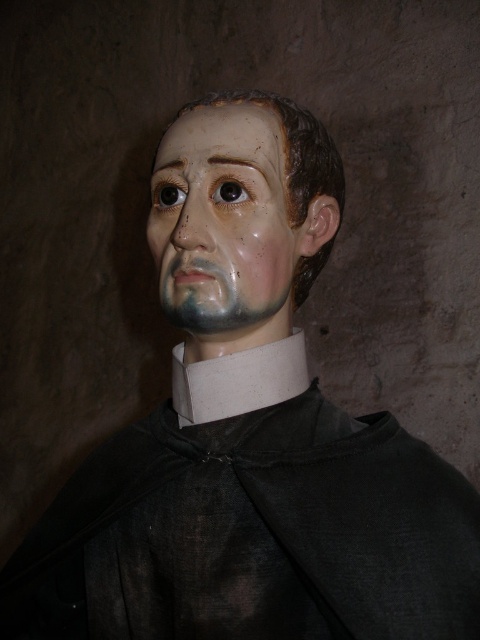
Question: Is black matte robe at center positioned behind matte plastic nose at center?

Choices:
 (A) yes
 (B) no

Answer: (B)

Question: In this image, where is black matte robe at center located relative to matte painted face at center?

Choices:
 (A) above
 (B) below

Answer: (B)

Question: Among these points, which one is nearest to the camera?

Choices:
 (A) (156, 262)
 (B) (183, 220)
 (C) (233, 568)

Answer: (C)

Question: Does black matte robe at center appear over matte painted face at center?

Choices:
 (A) yes
 (B) no

Answer: (B)

Question: Which point appears closest to the camera in this image?

Choices:
 (A) (160, 522)
 (B) (227, 198)

Answer: (B)

Question: Among these objects, which one is farthest from the camera?

Choices:
 (A) matte painted face at center
 (B) matte plastic nose at center

Answer: (B)